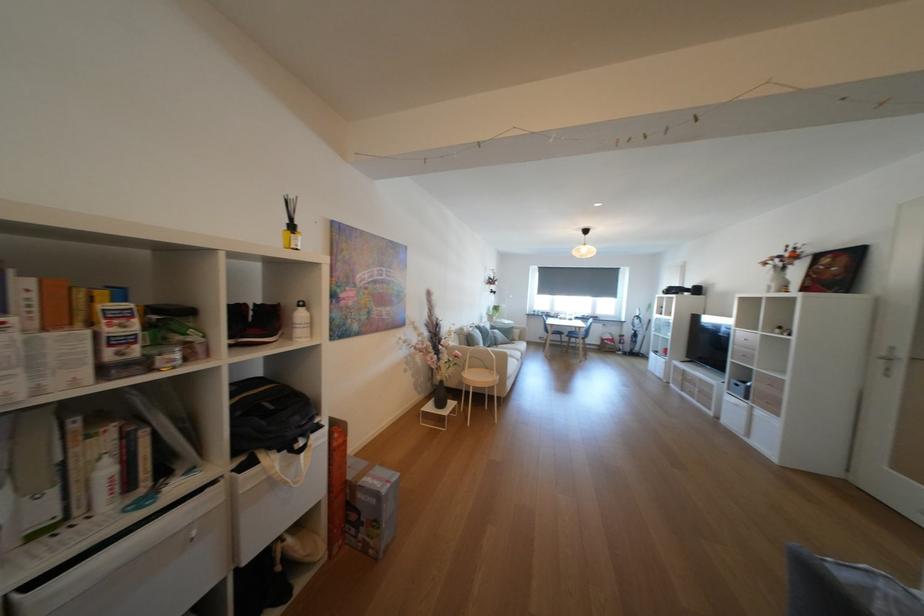
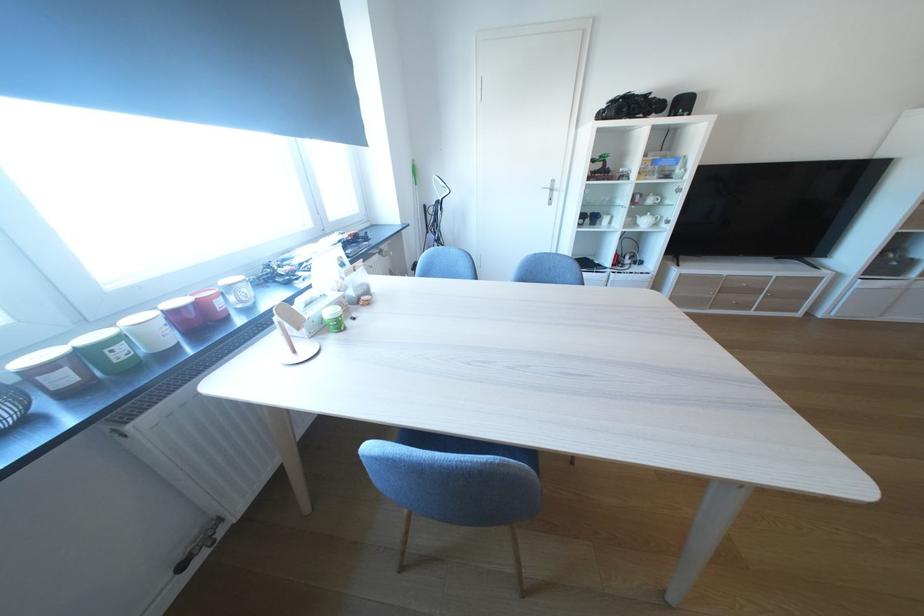
Find the pixel in the second image that matches the point at 561,315 in the first image.

(129, 354)